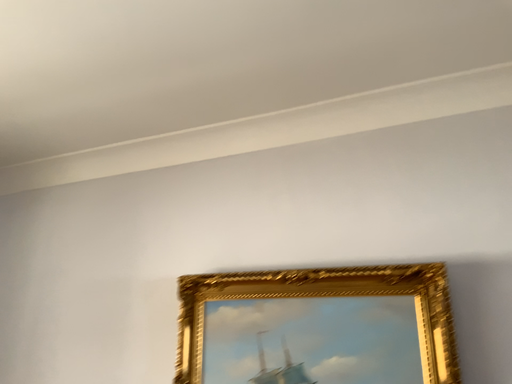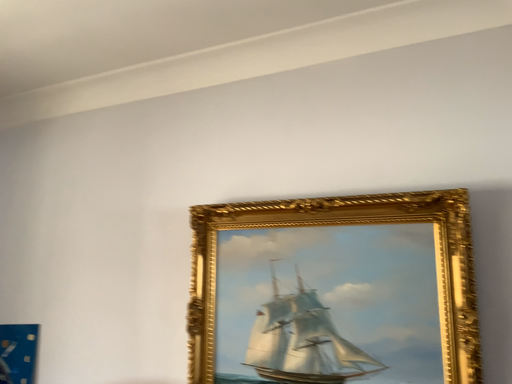
Question: Which way did the camera rotate in the video?

Choices:
 (A) rotated downward
 (B) rotated upward

Answer: (A)